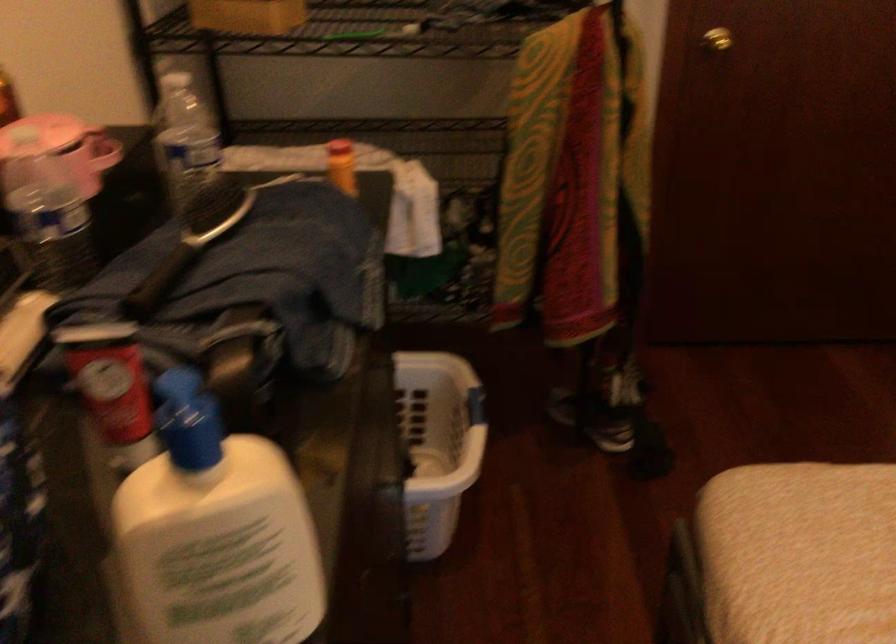
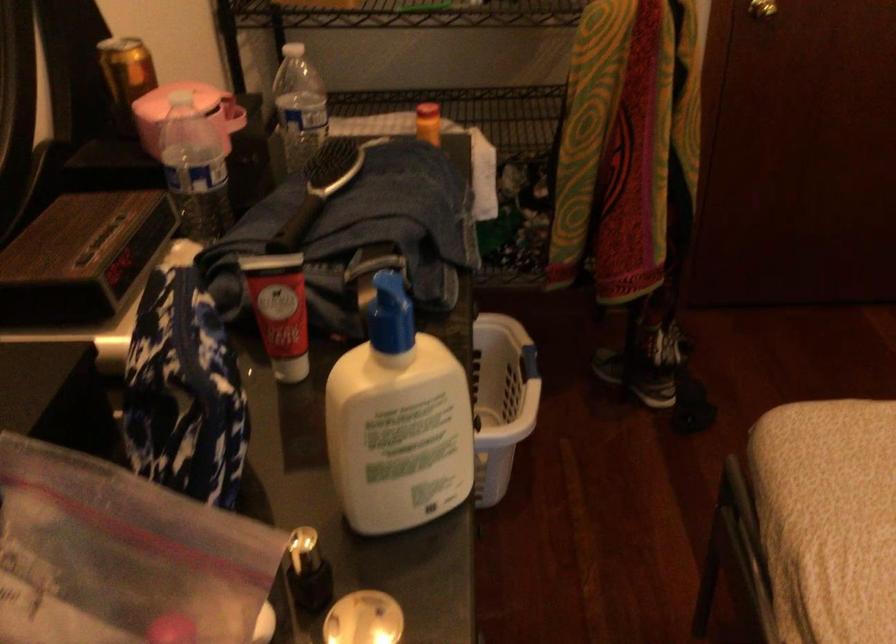
The point at (114, 384) is marked in the first image. Where is the corresponding point in the second image?

(280, 310)